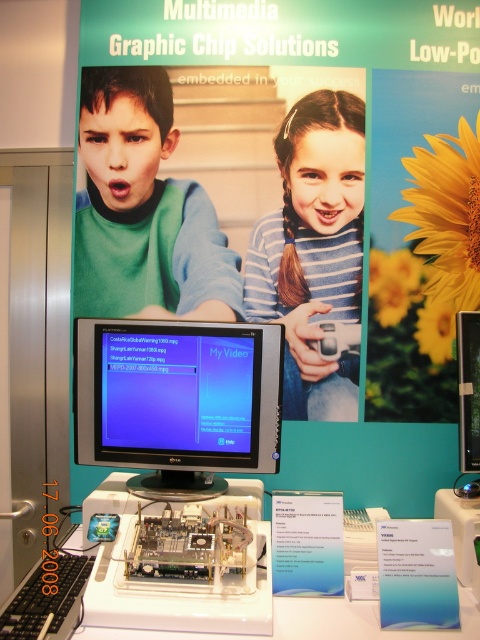
Is point (287, 404) closer to camera compared to point (156, 605)?

No, it is not.

Can you confirm if blue striped shirt at center is positioned below white plastic table at center?

No, blue striped shirt at center is not below white plastic table at center.

Which is in front, point (357, 269) or point (441, 630)?

Point (441, 630) is in front.

Locate an element on the screen. This screenshot has width=480, height=640. blue striped shirt at center is located at coordinates (313, 250).

Is green matte shirt at upper left to the right of blue striped shirt at center from the viewer's perspective?

Incorrect, green matte shirt at upper left is not on the right side of blue striped shirt at center.

Is point (108, 193) positioned in front of point (334, 400)?

No, it is not.

The image size is (480, 640). I want to click on green matte shirt at upper left, so click(144, 211).

The width and height of the screenshot is (480, 640). I want to click on green matte shirt at upper left, so click(144, 211).

Is satin black monitor at center bigger than blue striped shirt at center?

Indeed, satin black monitor at center has a larger size compared to blue striped shirt at center.

Between satin black monitor at center and blue striped shirt at center, which one has less height?

With less height is satin black monitor at center.

This screenshot has width=480, height=640. What are the coordinates of `satin black monitor at center` in the screenshot? It's located at (177, 401).